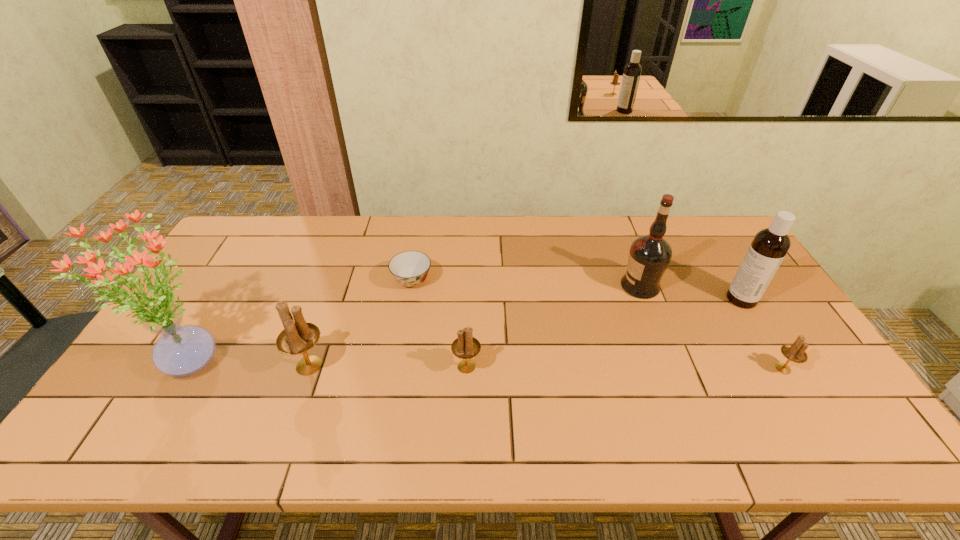
Please point a location where one more candle_holder can be added evenly. Please provide its 2D coordinates. Your answer should be formatted as a tuple, i.e. [(x, y)], where the tuple contains the x and y coordinates of a point satisfying the conditions above.

[(625, 368)]